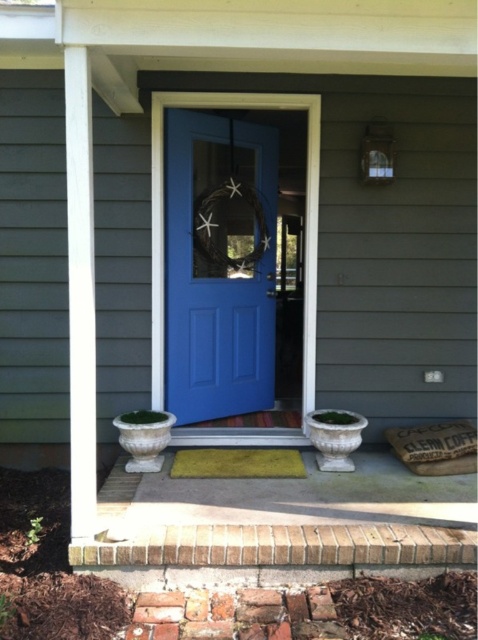
Question: Which point is farther to the camera?

Choices:
 (A) (180, 332)
 (B) (276, 477)

Answer: (A)

Question: Which point is farther from the camera taking this photo?

Choices:
 (A) (273, 317)
 (B) (261, 460)

Answer: (A)

Question: Is matte blue door at center to the right of yellow textured mat at center from the viewer's perspective?

Choices:
 (A) yes
 (B) no

Answer: (B)

Question: Where is matte blue door at center located in relation to yellow textured mat at center in the image?

Choices:
 (A) right
 (B) left

Answer: (B)

Question: Does matte blue door at center have a larger size compared to yellow textured mat at center?

Choices:
 (A) no
 (B) yes

Answer: (B)